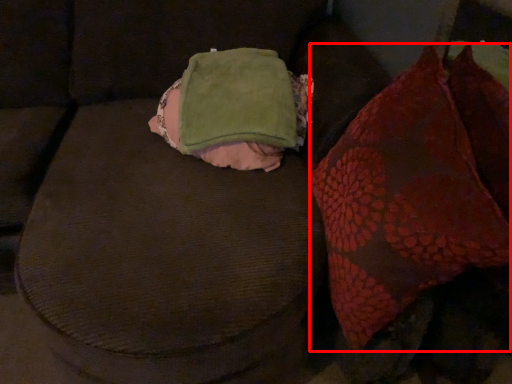
Question: From the image's perspective, where is throw pillow (annotated by the red box) located relative to bean bag chair?

Choices:
 (A) above
 (B) below

Answer: (B)